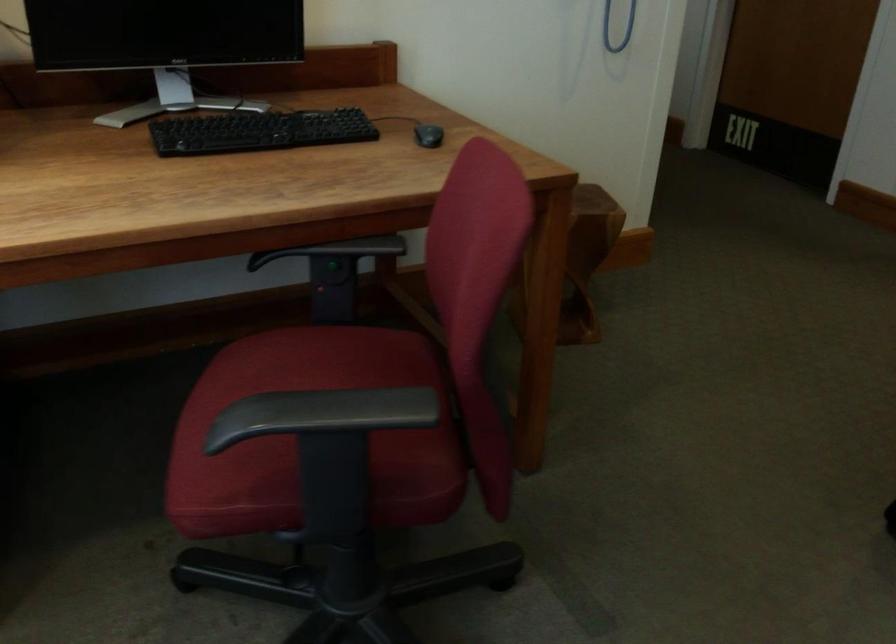
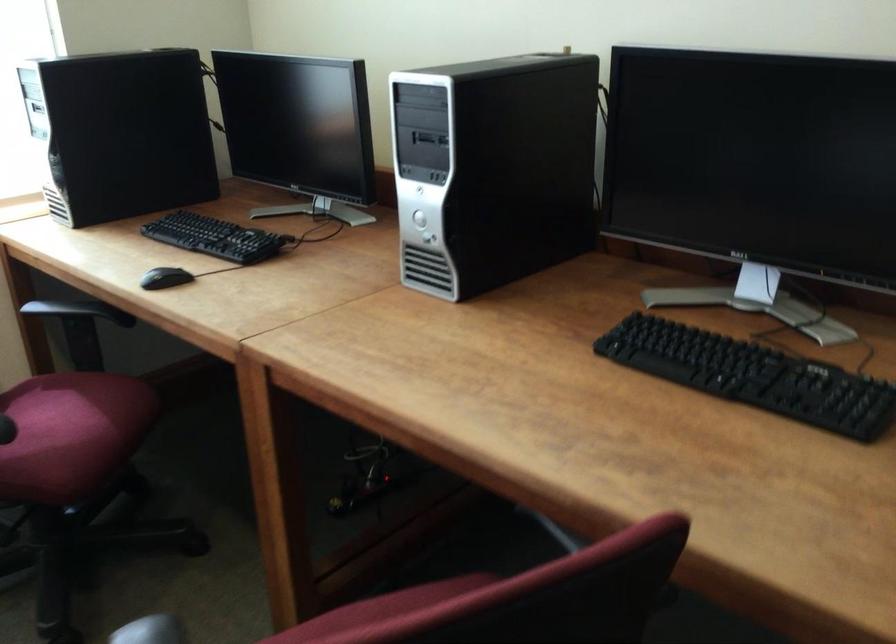
In the second image, find the point that corresponds to (x=214, y=395) in the first image.

(381, 608)